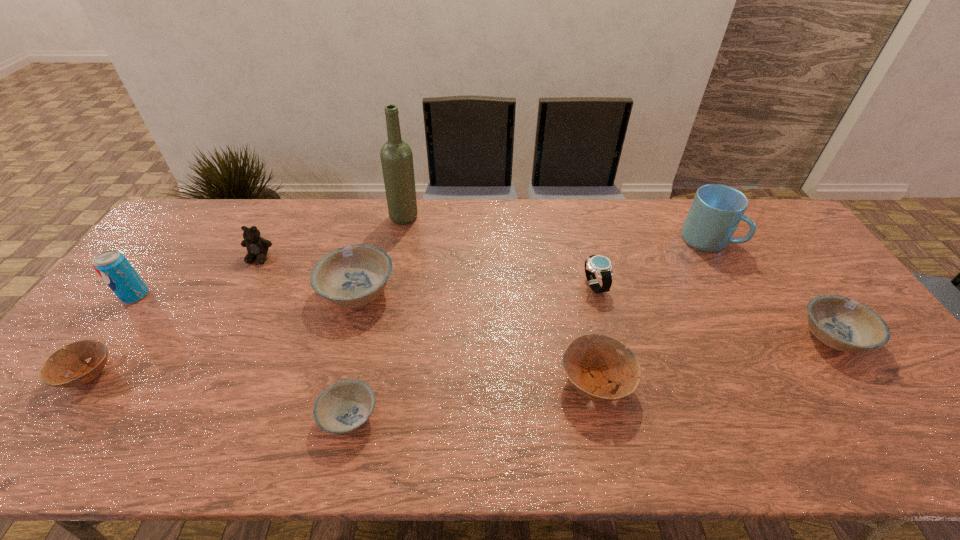
The width and height of the screenshot is (960, 540). What are the coordinates of `free location located 0.100m on the back of the biggest blue bowl` in the screenshot? It's located at (371, 245).

This screenshot has height=540, width=960. Identify the location of vacant area situated 0.390m on the back of the fourth bowl from left to right. (568, 252).

The width and height of the screenshot is (960, 540). In order to click on vacant space located on the left of the rightmost blue bowl in this screenshot , I will do pos(735,336).

The height and width of the screenshot is (540, 960). Identify the location of vacant space located 0.210m on the right of the smaller brown bowl. (200, 375).

At what (x,y) coordinates should I click in order to perform the action: click on free space located 0.140m on the left of the nearest blue bowl. Please return your answer as a coordinate pair (x, y). Looking at the image, I should click on (259, 416).

This screenshot has width=960, height=540. Identify the location of wine bottle at the far edge. (396, 155).

The width and height of the screenshot is (960, 540). Identify the location of mug at the far edge. (716, 211).

The height and width of the screenshot is (540, 960). What are the coordinates of `object present at the near edge` in the screenshot? It's located at (344, 407).

The width and height of the screenshot is (960, 540). In order to click on soda can situated at the left edge in this screenshot , I will do `click(113, 267)`.

You are a GUI agent. You are given a task and a screenshot of the screen. Output one action in this format:
    pyautogui.click(x=<x>, y=<y>)
    Task: Click on the bowl present at the left edge
    Image resolution: width=960 pixels, height=540 pixels.
    Given the screenshot: What is the action you would take?
    pyautogui.click(x=53, y=371)